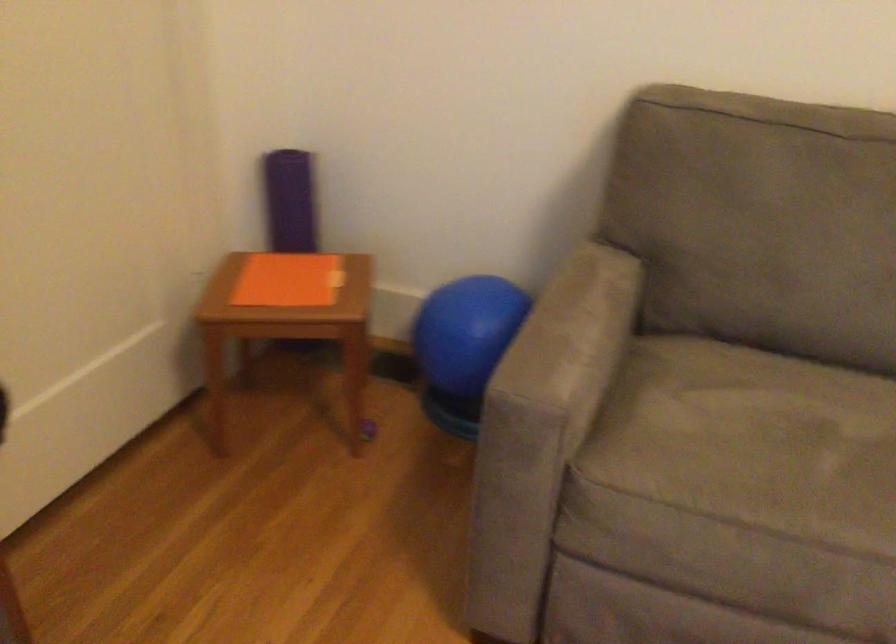
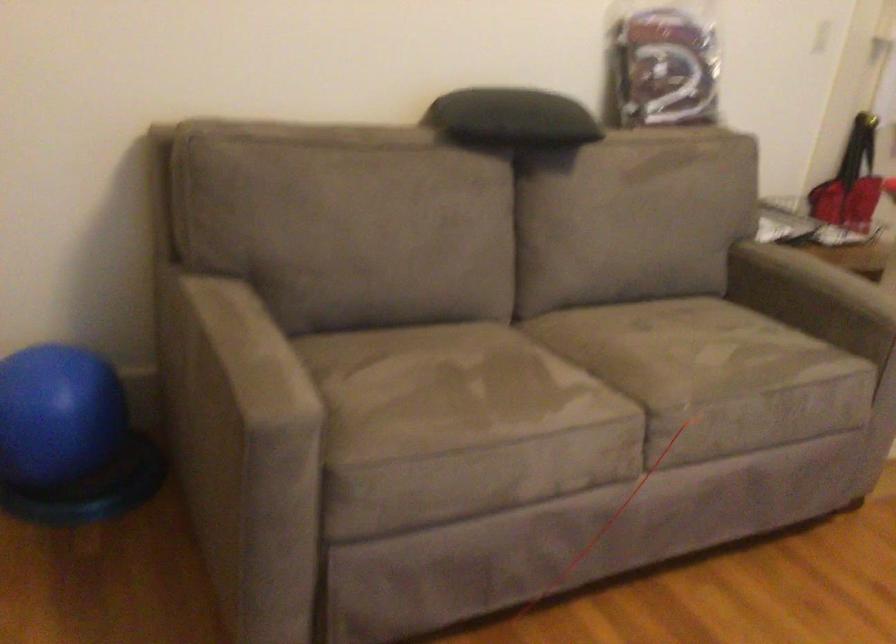
Question: The camera is either moving clockwise (left) or counter-clockwise (right) around the object. The first image is from the beginning of the video and the second image is from the end. Is the camera moving left or right when shooting the video?

Choices:
 (A) Left
 (B) Right

Answer: (A)